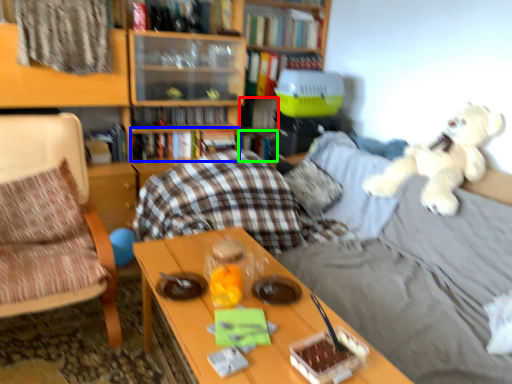
Question: Which is farther away from book (highlighted by a red box)? book (highlighted by a blue box) or book (highlighted by a green box)?

Choices:
 (A) book
 (B) book

Answer: (A)